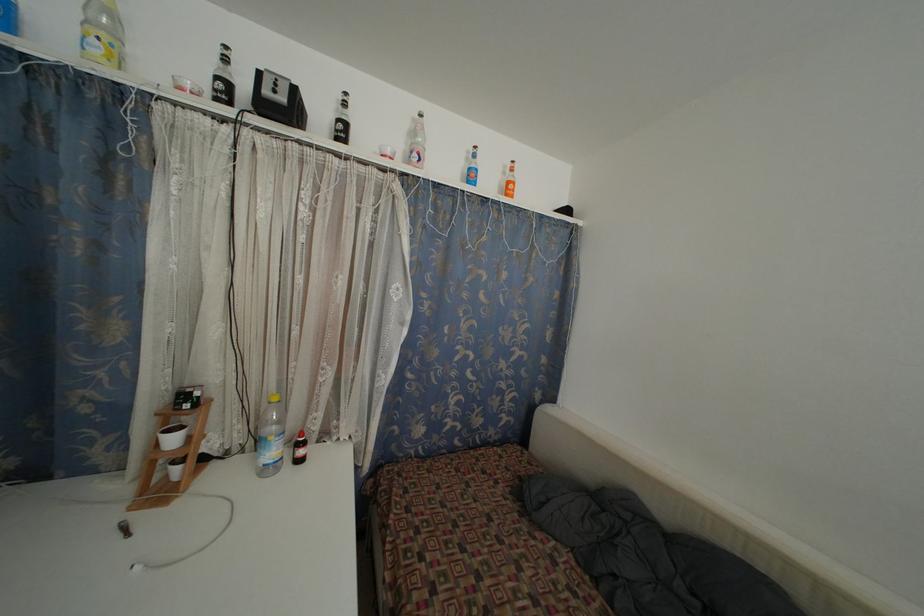
Where is `small green box`? Image resolution: width=924 pixels, height=616 pixels. small green box is located at coordinates (277, 99).